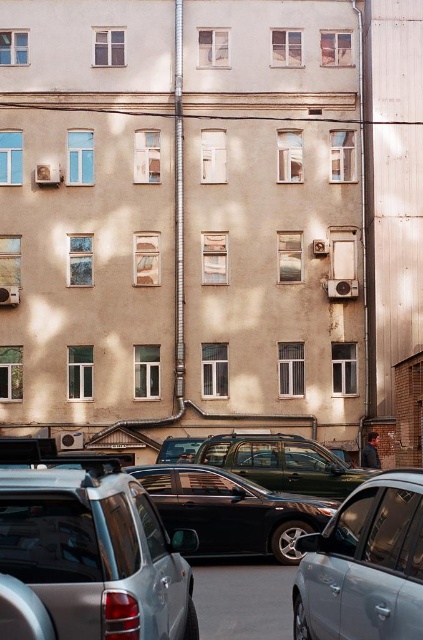
Does point (406, 545) lie behind point (228, 483)?

No, it is not.

At what (x,y) coordinates should I click in order to perform the action: click on metallic gray sedan at center. Please return your answer as a coordinate pair (x, y). Looking at the image, I should click on (365, 564).

Is point (409, 566) positioned in front of point (181, 480)?

Yes, it is in front of point (181, 480).

Locate an element on the screen. The image size is (423, 640). metallic gray sedan at center is located at coordinates (365, 564).

The height and width of the screenshot is (640, 423). Find the location of `satin silver car at center`. satin silver car at center is located at coordinates (95, 554).

Does satin silver car at center have a lesser height compared to black plastic license plate at center?

No, satin silver car at center is not shorter than black plastic license plate at center.

Who is more distant from viewer, (128,628) or (197,536)?

Positioned behind is point (197,536).

Where is `satin silver car at center`? The image size is (423, 640). satin silver car at center is located at coordinates (95, 554).

Is metallic gray sedan at center below metallic green suv at center?

No.

From the picture: Who is more distant from viewer, (356, 573) or (225, 436)?

The point (225, 436) is behind.

Which is in front, point (324, 627) or point (315, 464)?

Point (324, 627) is more forward.

This screenshot has height=640, width=423. I want to click on metallic gray sedan at center, so click(365, 564).